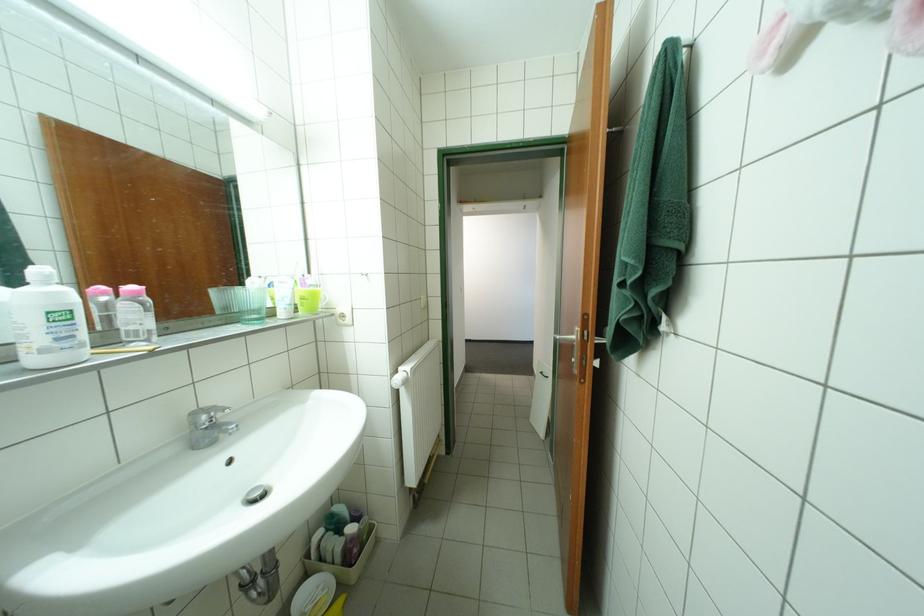
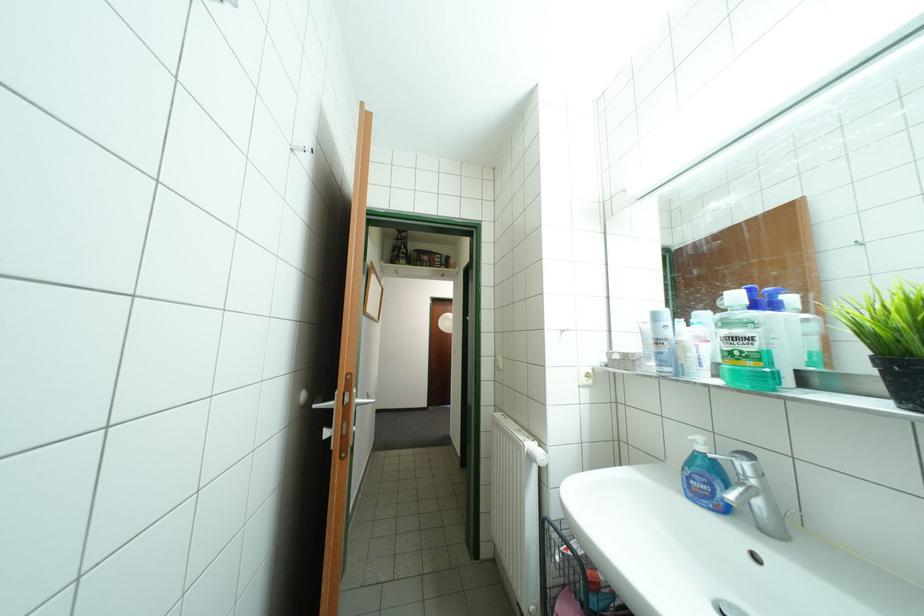
Question: What movement of the cameraman would produce the second image?

Choices:
 (A) Left
 (B) Right
 (C) Forward
 (D) Backward

Answer: (A)